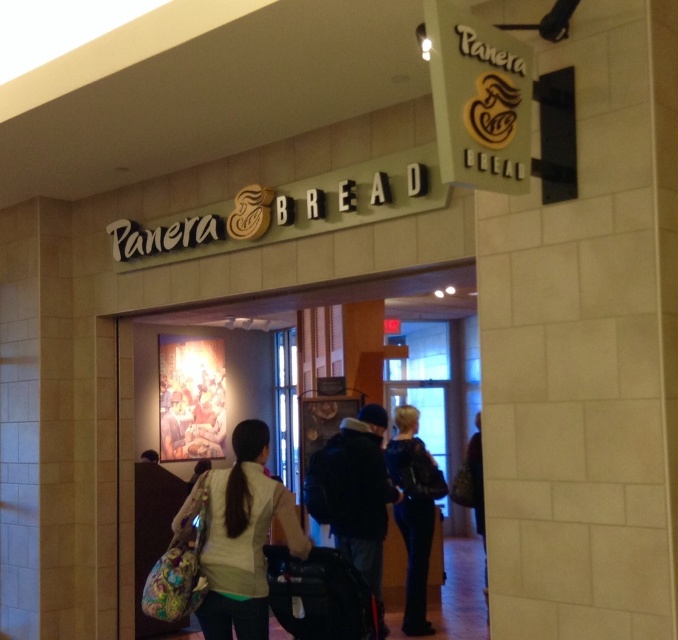
Is white fabric backpack at center thinner than leather jacket at center?

In fact, white fabric backpack at center might be wider than leather jacket at center.

Which is below, white fabric backpack at center or leather jacket at center?

leather jacket at center is lower down.

Describe the element at coordinates (239, 536) in the screenshot. I see `white fabric backpack at center` at that location.

Where is `white fabric backpack at center`? Image resolution: width=678 pixels, height=640 pixels. white fabric backpack at center is located at coordinates [x=239, y=536].

Between black fabric backpack at center and leather jacket at center, which one appears on the right side from the viewer's perspective?

leather jacket at center

Does black fabric backpack at center lie in front of leather jacket at center?

Yes, black fabric backpack at center is closer to the viewer.

Is point (317, 550) in front of point (412, 465)?

Yes, it is.

Locate an element on the screen. The width and height of the screenshot is (678, 640). black fabric backpack at center is located at coordinates (319, 595).

Locate an element on the screen. This screenshot has width=678, height=640. white fabric backpack at center is located at coordinates (239, 536).

In the scene shown: Between white fabric backpack at center and black fabric backpack at center, which one appears on the right side from the viewer's perspective?

Positioned to the right is black fabric backpack at center.

Is point (224, 577) less distant than point (296, 634)?

Yes.

Locate an element on the screen. The height and width of the screenshot is (640, 678). white fabric backpack at center is located at coordinates (239, 536).